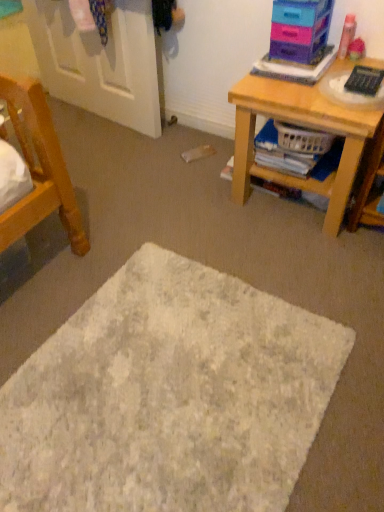
Locate an element on the screen. This screenshot has height=512, width=384. vacant space situated above wooden desk at right (from a real-world perspective) is located at coordinates (316, 79).